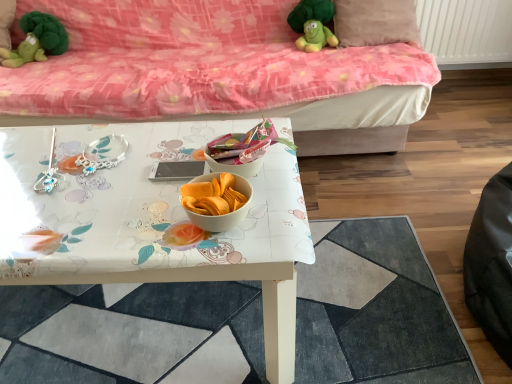
You are a GUI agent. You are given a task and a screenshot of the screen. Output one action in this format:
    pyautogui.click(x=<x>, y=<y>)
    Task: Click on the free space above white glossy table at center (from a real-world perspective)
    The image size is (512, 384).
    Given the screenshot: What is the action you would take?
    pyautogui.click(x=108, y=173)